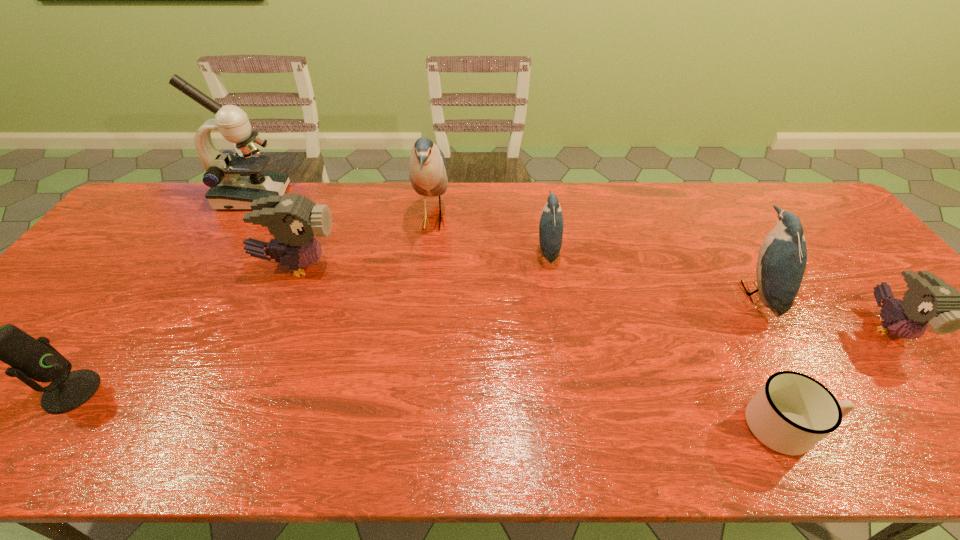
What are the coordinates of `free space at the far edge` in the screenshot? It's located at (410, 217).

The height and width of the screenshot is (540, 960). Identify the location of free space at the near edge. (84, 416).

At what (x,y) coordinates should I click in order to perform the action: click on blank space at the right edge of the desktop. Please return your answer as a coordinate pair (x, y). The image size is (960, 540). Looking at the image, I should click on (938, 360).

Locate an element on the screen. vacant space at the far right corner is located at coordinates (784, 187).

You are a GUI agent. You are given a task and a screenshot of the screen. Output one action in this format:
    pyautogui.click(x=<x>, y=<y>)
    Task: Click on the empty space between the shortest object and the microscope
    This screenshot has width=960, height=540.
    Given the screenshot: What is the action you would take?
    pyautogui.click(x=520, y=312)

Where is `free space between the farther gray bird and the third bird from left to right`? This screenshot has width=960, height=540. free space between the farther gray bird and the third bird from left to right is located at coordinates (422, 258).

Find the location of `vacant area between the microscope and the mug`. vacant area between the microscope and the mug is located at coordinates (520, 312).

You are a GUI agent. You are given a task and a screenshot of the screen. Output one action in this format:
    pyautogui.click(x=<x>, y=<y>)
    Task: Click on the free point between the microphone and the nearer gray bird
    
    Given the screenshot: What is the action you would take?
    pyautogui.click(x=480, y=360)

Identify the location of empty space between the leftmost bird and the smallest blue bird. The height and width of the screenshot is (540, 960). (422, 258).

Locate an element on the screen. This screenshot has height=540, width=960. free area in between the smallest blue bird and the bigger gray bird is located at coordinates (422, 258).